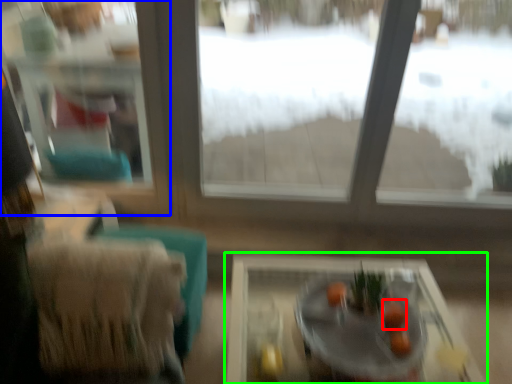
Question: Considering the real-world distances, which object is closest to fruit (highlighted by a red box)? window frame (highlighted by a blue box) or table (highlighted by a green box).

Choices:
 (A) window frame
 (B) table

Answer: (B)